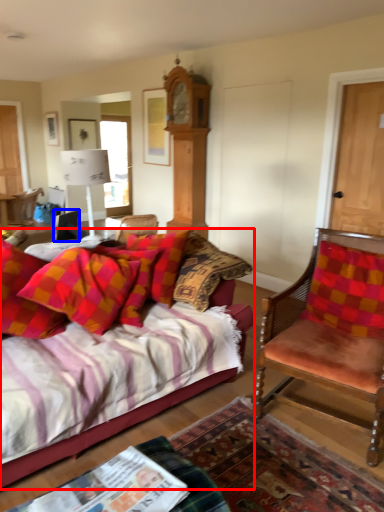
Question: Which object appears closest to the camera in this image, studio couch (highlighted by a red box) or corded phone (highlighted by a blue box)?

Choices:
 (A) studio couch
 (B) corded phone

Answer: (A)